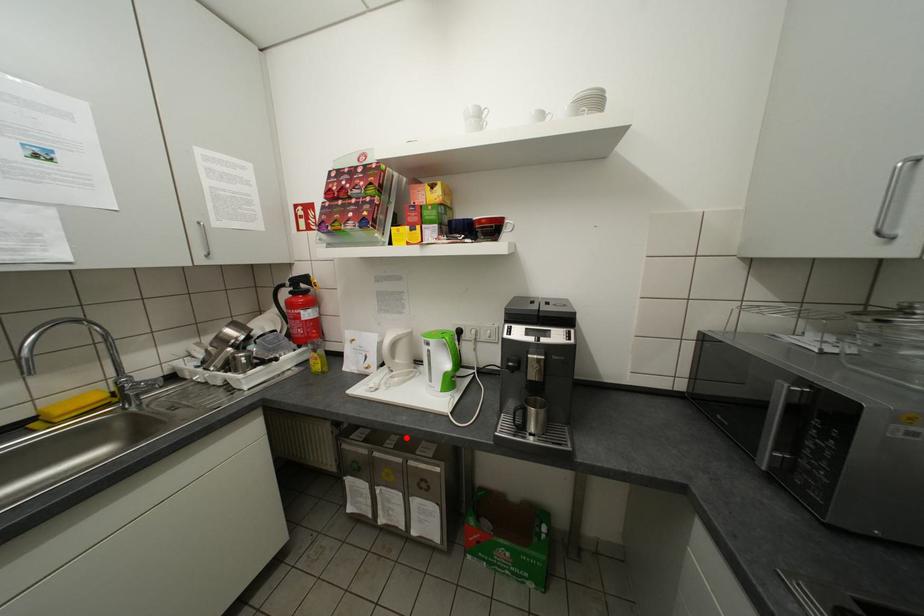
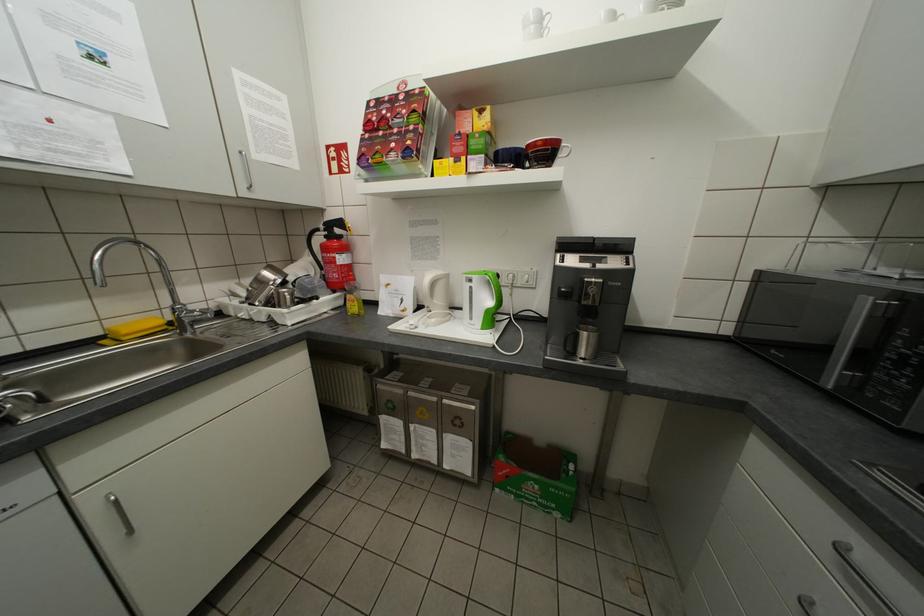
Locate, in the second image, the point that corresponds to the highlighted location in the first image.

(440, 379)